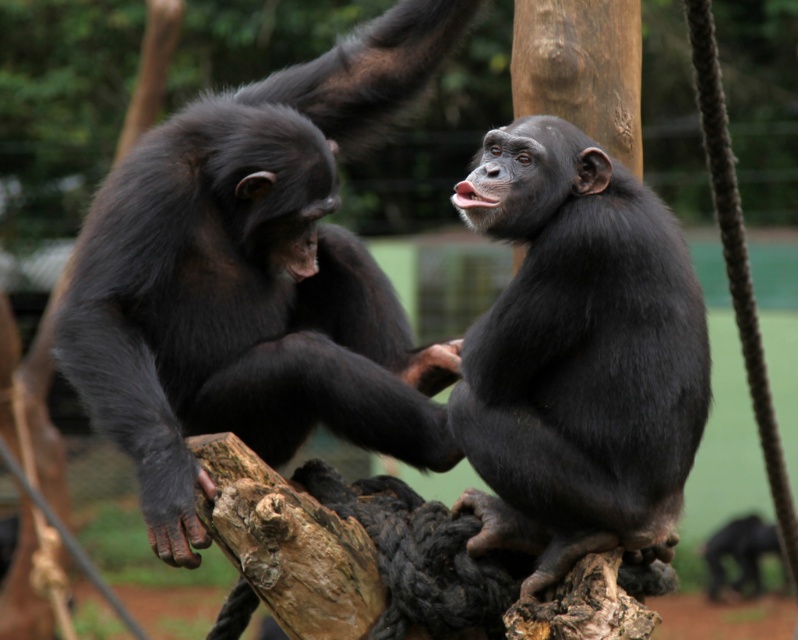
Is shiny black monkey at upper right to the left of shiny black monkey at center from the viewer's perspective?

Indeed, shiny black monkey at upper right is positioned on the left side of shiny black monkey at center.

Between point (188, 179) and point (652, 552), which one is positioned behind?

Point (188, 179)

Who is more forward, (93, 385) or (508, 170)?

Positioned in front is point (508, 170).

In order to click on shiny black monkey at upper right in this screenshot , I will do `click(255, 280)`.